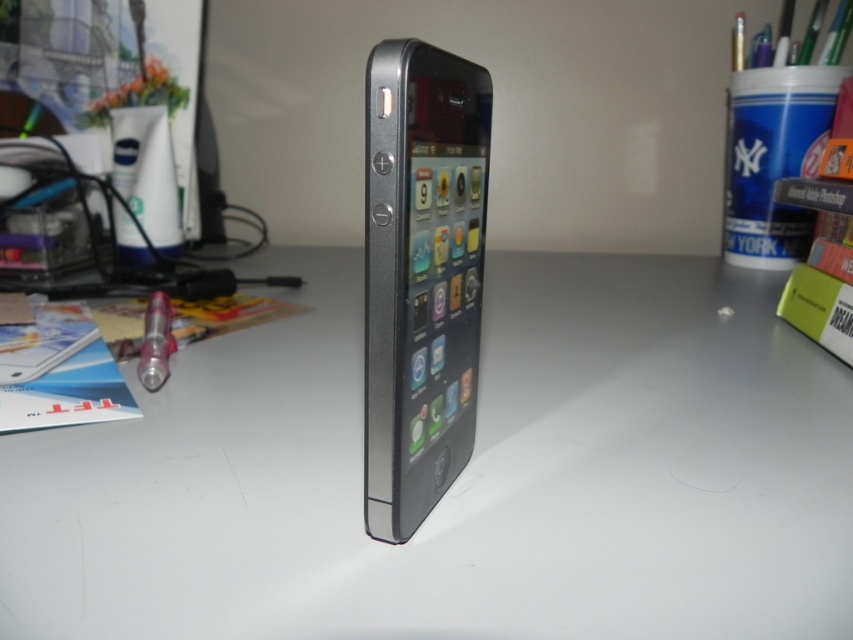
Is white matte table at center wider than matte white lotion at left?

Correct, the width of white matte table at center exceeds that of matte white lotion at left.

Who is taller, white matte table at center or matte white lotion at left?

matte white lotion at left

Where is `white matte table at center`? The width and height of the screenshot is (853, 640). white matte table at center is located at coordinates (460, 474).

The image size is (853, 640). Find the location of `white matte table at center`. white matte table at center is located at coordinates (460, 474).

Who is lower down, white matte table at center or metallic pen at left?

metallic pen at left is lower down.

Is point (674, 436) more distant than point (166, 305)?

No, it is not.

Between point (697, 548) and point (154, 294), which one is positioned in front?

Point (697, 548) is in front.

Where is `white matte table at center`? The height and width of the screenshot is (640, 853). white matte table at center is located at coordinates (460, 474).

The width and height of the screenshot is (853, 640). Identify the location of white matte table at center. (460, 474).

Which is in front, point (468, 625) or point (444, 410)?

Point (468, 625) is in front.

Who is more distant from viewer, (335, 560) or (401, 387)?

The point (335, 560) is more distant.

Locate an element on the screen. The width and height of the screenshot is (853, 640). white matte table at center is located at coordinates (460, 474).